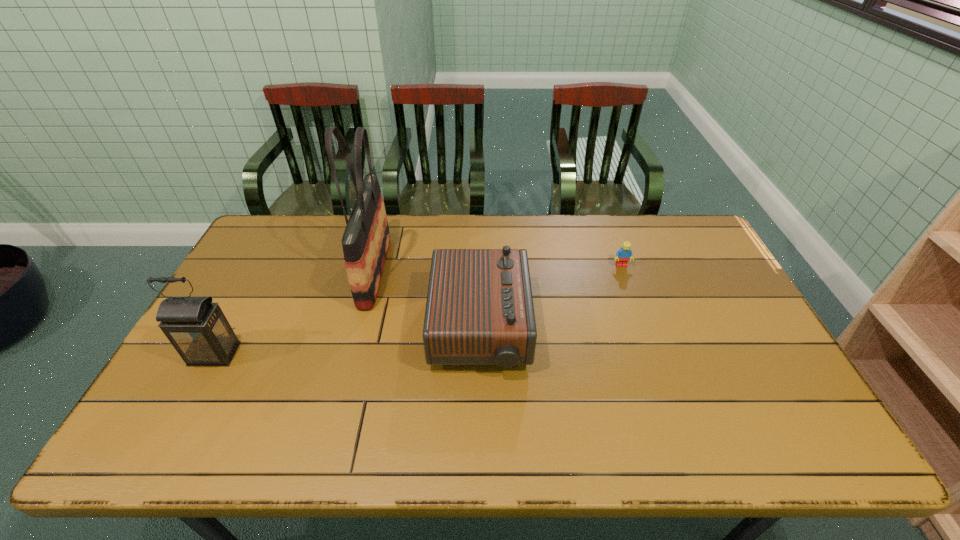
Locate an element on the screen. vacant area that lies between the lantern and the Lego is located at coordinates (418, 310).

At what (x,y) coordinates should I click in order to perform the action: click on free spot between the second shortest object and the shortest object. Please return your answer as a coordinate pair (x, y). The width and height of the screenshot is (960, 540). Looking at the image, I should click on (551, 298).

The image size is (960, 540). I want to click on empty space between the lantern and the tallest object, so point(295,313).

What are the coordinates of `unoccupied position between the shopping bag and the leftmost object` in the screenshot? It's located at [x=295, y=313].

The height and width of the screenshot is (540, 960). Identify the location of free space between the third object from right to left and the lantern. (295, 313).

Find the location of `object that stands as the closest to the shopping bag`. object that stands as the closest to the shopping bag is located at coordinates (479, 311).

Locate which object ranks third in proximity to the shopping bag. Please provide its 2D coordinates. Your answer should be formatted as a tuple, i.e. [(x, y)], where the tuple contains the x and y coordinates of a point satisfying the conditions above.

[(623, 255)]

Where is `free location that satisfies the following two spatial constraints: 1. on the face of the rightmost object; 2. on the front-facing side of the shopping bag`? This screenshot has height=540, width=960. free location that satisfies the following two spatial constraints: 1. on the face of the rightmost object; 2. on the front-facing side of the shopping bag is located at coordinates (623, 271).

The width and height of the screenshot is (960, 540). Identify the location of free location that satisfies the following two spatial constraints: 1. on the face of the shortest object; 2. on the front panel of the third object from left to right. (644, 329).

Locate an element on the screen. This screenshot has width=960, height=540. free location that satisfies the following two spatial constraints: 1. on the face of the rightmost object; 2. on the front-facing side of the tallest object is located at coordinates (623, 271).